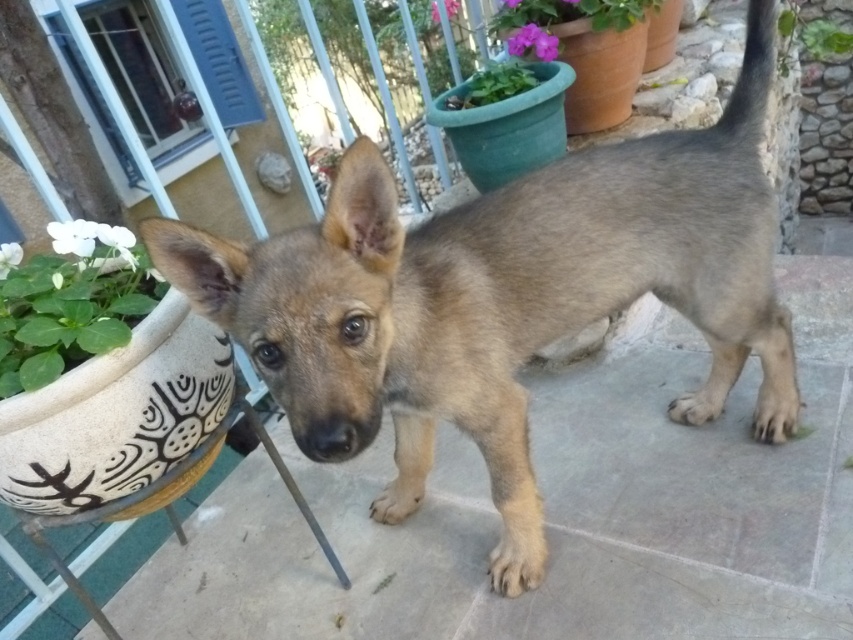
You are trying to take a photo of the green leafy plant at lower left but the fuzzy brown puppy at center is blocking your view. Can you move the puppy to the side so you can see the plant clearly?

The fuzzy brown puppy at center is in front of the green leafy plant at lower left, so moving the puppy aside would allow you to see the plant clearly.

You are standing on the patio and want to take a photo of the fuzzy brown puppy at center and the green leafy plant at upper right. Which object is positioned to the left of the other?

The fuzzy brown puppy at center is to the left of the green leafy plant at upper right.